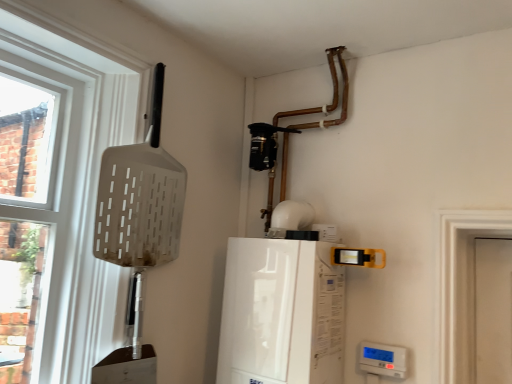
Describe the element at coordinates (383, 359) in the screenshot. This screenshot has width=512, height=384. I see `white plastic thermostat at lower right, which is counted as the second appliance, starting from the left` at that location.

I want to click on white plastic shovel at left, so click(140, 205).

In order to face white glossy boiler at center, the first appliance when ordered from top to bottom, should I rotate leftwards or rightwards?

You should rotate right by 3.002 degrees.

Locate an element on the screen. The width and height of the screenshot is (512, 384). white plastic thermostat at lower right, which is the 2th appliance from top to bottom is located at coordinates (383, 359).

Could you tell me if white plastic shovel at left is facing white glossy boiler at center, the first appliance when ordered from top to bottom?

No, white plastic shovel at left does not turn towards white glossy boiler at center, the first appliance when ordered from top to bottom.

Who is more distant, white plastic shovel at left or white glossy boiler at center, the first appliance when ordered from top to bottom?

Positioned behind is white glossy boiler at center, the first appliance when ordered from top to bottom.

Locate an element on the screen. This screenshot has height=384, width=512. the 1st appliance behind the white plastic shovel at left is located at coordinates (281, 313).

Can we say white plastic thermostat at lower right, which is the 2th appliance from top to bottom, lies outside white glossy boiler at center, the second appliance ordered from the bottom?

Yes, white plastic thermostat at lower right, which is the 2th appliance from top to bottom, is not within white glossy boiler at center, the second appliance ordered from the bottom.

How many degrees apart are the facing directions of white plastic thermostat at lower right, which is the 2th appliance from top to bottom, and white glossy boiler at center, the first appliance when ordered from top to bottom?

The facing directions of white plastic thermostat at lower right, which is the 2th appliance from top to bottom, and white glossy boiler at center, the first appliance when ordered from top to bottom, are 0.00147 degrees apart.

Considering the relative sizes of white plastic thermostat at lower right, which appears as the first appliance when ordered from the bottom, and white glossy boiler at center, the first appliance when ordered from top to bottom, in the image provided, is white plastic thermostat at lower right, which appears as the first appliance when ordered from the bottom, thinner than white glossy boiler at center, the first appliance when ordered from top to bottom,?

Indeed, white plastic thermostat at lower right, which appears as the first appliance when ordered from the bottom, has a lesser width compared to white glossy boiler at center, the first appliance when ordered from top to bottom.

In the scene shown: From the image's perspective, does white plastic thermostat at lower right, which is the 2th appliance from top to bottom, appear higher than white glossy boiler at center, arranged as the second appliance when viewed from the right?

No, from the image's perspective, white plastic thermostat at lower right, which is the 2th appliance from top to bottom, is not over white glossy boiler at center, arranged as the second appliance when viewed from the right.

Can you confirm if white glossy boiler at center, the second appliance ordered from the bottom, is wider than white plastic shovel at left?

Yes, white glossy boiler at center, the second appliance ordered from the bottom, is wider than white plastic shovel at left.

From a real-world perspective, is white glossy boiler at center, the second appliance ordered from the bottom, positioned above or below white plastic shovel at left?

Clearly, from a real-world perspective, white glossy boiler at center, the second appliance ordered from the bottom, is below white plastic shovel at left.

Where is `shovel located above the white glossy boiler at center, arranged as the second appliance when viewed from the right (from the image's perspective)`? shovel located above the white glossy boiler at center, arranged as the second appliance when viewed from the right (from the image's perspective) is located at coordinates (140, 205).

In terms of width, does white plastic shovel at left look wider or thinner when compared to white plastic thermostat at lower right, which is counted as the second appliance, starting from the left?

white plastic shovel at left is wider than white plastic thermostat at lower right, which is counted as the second appliance, starting from the left.

Is white plastic thermostat at lower right, the first appliance in the right-to-left sequence, inside white plastic shovel at left?

No, white plastic thermostat at lower right, the first appliance in the right-to-left sequence, is located outside of white plastic shovel at left.

Between point (153, 181) and point (391, 366), which one is positioned in front?

Point (391, 366)

Considering the relative sizes of white plastic shovel at left and white plastic thermostat at lower right, which appears as the first appliance when ordered from the bottom, in the image provided, is white plastic shovel at left smaller than white plastic thermostat at lower right, which appears as the first appliance when ordered from the bottom,?

No.

Does white glossy boiler at center, arranged as the second appliance when viewed from the right, appear on the left side of white plastic thermostat at lower right, which is the 2th appliance from top to bottom?

Yes, white glossy boiler at center, arranged as the second appliance when viewed from the right, is to the left of white plastic thermostat at lower right, which is the 2th appliance from top to bottom.

Is white glossy boiler at center, which appears as the first appliance when viewed from the left, smaller than white plastic thermostat at lower right, which is the 2th appliance from top to bottom?

No, white glossy boiler at center, which appears as the first appliance when viewed from the left, is not smaller than white plastic thermostat at lower right, which is the 2th appliance from top to bottom.

From the image's perspective, which is below, white glossy boiler at center, the second appliance ordered from the bottom, or white plastic thermostat at lower right, which is the 2th appliance from top to bottom?

white plastic thermostat at lower right, which is the 2th appliance from top to bottom.

From a real-world perspective, who is located lower, white glossy boiler at center, arranged as the second appliance when viewed from the right, or white plastic thermostat at lower right, the first appliance in the right-to-left sequence?

white plastic thermostat at lower right, the first appliance in the right-to-left sequence, from a real-world perspective.

What's the angular difference between white plastic thermostat at lower right, which is the 2th appliance from top to bottom, and white plastic shovel at left's facing directions?

They differ by 88.4 degrees in their facing directions.

Is the depth of white plastic thermostat at lower right, the first appliance in the right-to-left sequence, less than that of white plastic shovel at left?

That is False.

The image size is (512, 384). Identify the location of the 2nd appliance below when counting from the white plastic shovel at left (from the image's perspective). (383, 359).

Considering the positions of objects white plastic thermostat at lower right, which appears as the first appliance when ordered from the bottom, and white plastic shovel at left in the image provided, who is more to the right, white plastic thermostat at lower right, which appears as the first appliance when ordered from the bottom, or white plastic shovel at left?

From the viewer's perspective, white plastic thermostat at lower right, which appears as the first appliance when ordered from the bottom, appears more on the right side.

This screenshot has height=384, width=512. What are the coordinates of `appliance that is the 1st object located behind the white plastic shovel at left` in the screenshot? It's located at (281, 313).

Find the location of a particular element. Image resolution: width=512 pixels, height=384 pixels. appliance above the white plastic thermostat at lower right, the first appliance in the right-to-left sequence (from a real-world perspective) is located at coordinates (281, 313).

Considering their positions, is white plastic shovel at left positioned further to white plastic thermostat at lower right, which is counted as the second appliance, starting from the left, than white glossy boiler at center, which appears as the first appliance when viewed from the left?

Among the two, white plastic shovel at left is located further to white plastic thermostat at lower right, which is counted as the second appliance, starting from the left.

From the image, which object appears to be farther from white plastic shovel at left, white plastic thermostat at lower right, which appears as the first appliance when ordered from the bottom, or white glossy boiler at center, which appears as the first appliance when viewed from the left?

The object further to white plastic shovel at left is white plastic thermostat at lower right, which appears as the first appliance when ordered from the bottom.

Considering their positions, is white plastic shovel at left positioned closer to white glossy boiler at center, arranged as the second appliance when viewed from the right, than white plastic thermostat at lower right, which is counted as the second appliance, starting from the left?

The object closer to white glossy boiler at center, arranged as the second appliance when viewed from the right, is white plastic thermostat at lower right, which is counted as the second appliance, starting from the left.

Looking at the image, which one is located further to white plastic thermostat at lower right, which appears as the first appliance when ordered from the bottom, white glossy boiler at center, the first appliance when ordered from top to bottom, or white plastic shovel at left?

white plastic shovel at left.

From the image, which object appears to be farther from white glossy boiler at center, the first appliance when ordered from top to bottom, white plastic thermostat at lower right, which appears as the first appliance when ordered from the bottom, or white plastic shovel at left?

white plastic shovel at left.

Based on their spatial positions, is white glossy boiler at center, arranged as the second appliance when viewed from the right, or white plastic thermostat at lower right, which is the 2th appliance from top to bottom, closer to white plastic shovel at left?

Based on the image, white glossy boiler at center, arranged as the second appliance when viewed from the right, appears to be nearer to white plastic shovel at left.

Find the location of a particular element. appliance between white plastic shovel at left and white plastic thermostat at lower right, the first appliance in the right-to-left sequence is located at coordinates (281, 313).